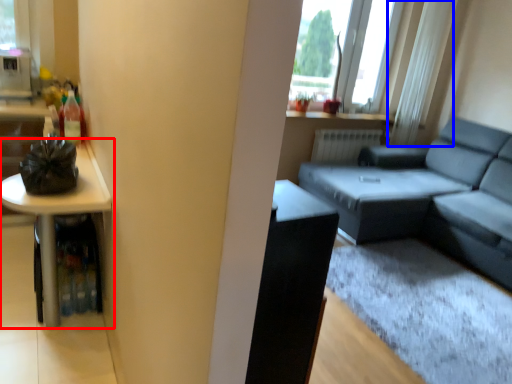
Question: Which point is further to the camera, table (highlighted by a red box) or curtain (highlighted by a blue box)?

Choices:
 (A) table
 (B) curtain

Answer: (B)